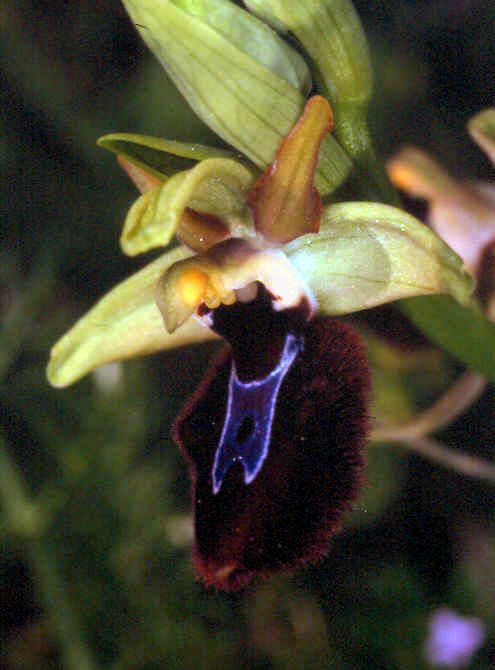
Find the location of a particular element. column is located at coordinates (289, 291).